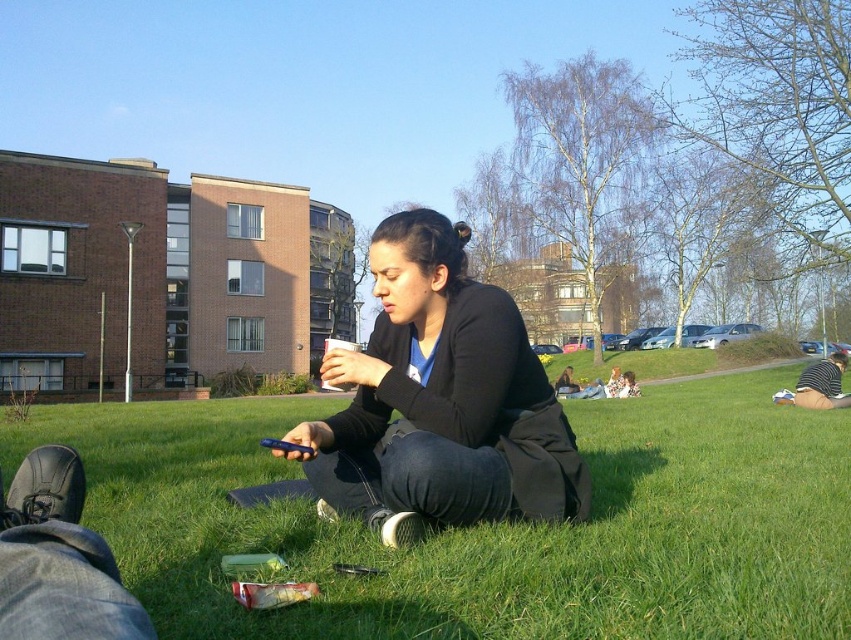
You are a gardener who wants to mow the green grass at center. However, there is a black matte jacket at center in the way. Can you mow the grass without moving the jacket?

The green grass at center is shorter than black matte jacket at center, so the jacket is taller than the grass. This means the mower might hit the jacket, so you should move it first before mowing.

You are standing at the edge of a grassy area and want to place a 2.0 meter long banner on the ground so that it reaches from where you are standing to the green grass at center. Is the banner long enough to cover that distance?

The green grass at center is 1.85 meters from viewer. Since the banner is 2.0 meters long, it is longer than the distance required, so the banner will be long enough to cover the distance from where you are standing to the green grass at center.

You are a drone operator trying to capture a photo of the green grass at center. According to the coordinates provided, where should you position the drone to get the best shot?

The green grass at center is located at point (490, 525), so the drone should be positioned there to capture the best shot.